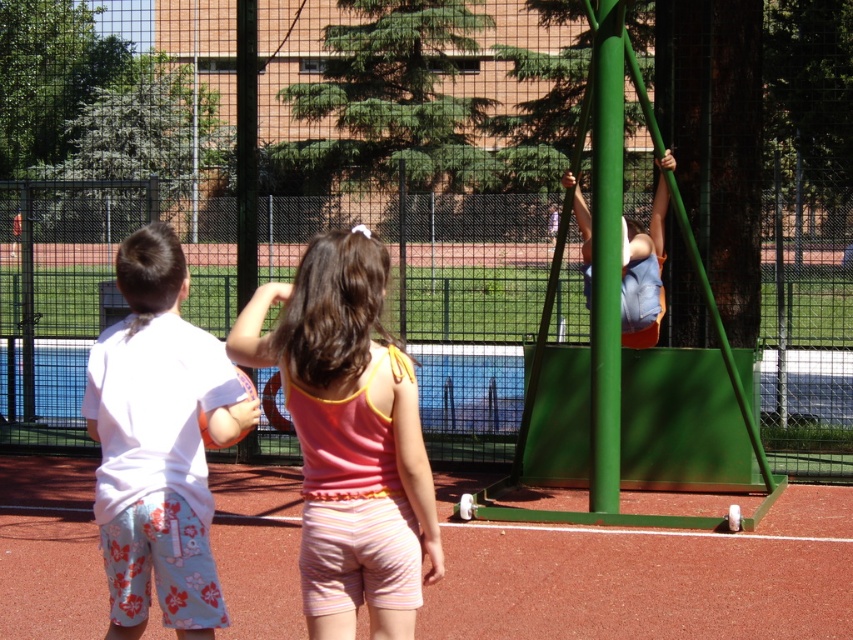
Question: Does pink fabric shorts at center appear over pink fabric tank top at center?

Choices:
 (A) no
 (B) yes

Answer: (A)

Question: Estimate the real-world distances between objects in this image. Which object is closer to the white cotton shirt at left?

Choices:
 (A) pink fabric tank top at center
 (B) light blue denim shorts at upper right
 (C) green matte pole at center
 (D) pink fabric shorts at center

Answer: (A)

Question: Considering the real-world distances, which object is closest to the light blue denim shorts at upper right?

Choices:
 (A) green matte pole at center
 (B) pink fabric shorts at center
 (C) pink fabric tank top at center

Answer: (A)

Question: Where is green matte pole at center located in relation to light blue denim shorts at upper right in the image?

Choices:
 (A) below
 (B) above

Answer: (A)

Question: Is pink fabric shorts at center to the right of green matte pole at center from the viewer's perspective?

Choices:
 (A) no
 (B) yes

Answer: (A)

Question: Which point is closer to the camera taking this photo?

Choices:
 (A) (248, 336)
 (B) (195, 348)
 (C) (247, 513)

Answer: (B)